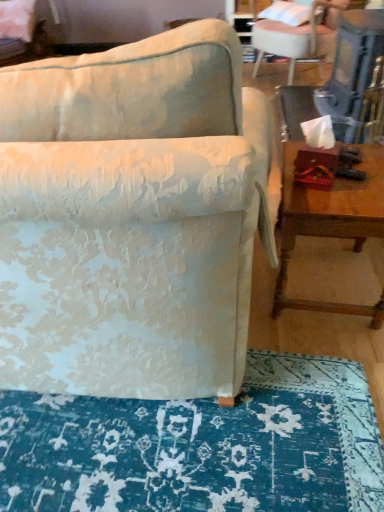
Question: Could you tell me if blue textured rug at lower center is facing white fabric chair at upper right, arranged as the second chair when viewed from the left?

Choices:
 (A) yes
 (B) no

Answer: (B)

Question: Are blue textured rug at lower center and white fabric chair at upper right, the 1th chair from the top, located far from each other?

Choices:
 (A) no
 (B) yes

Answer: (B)

Question: From a real-world perspective, is blue textured rug at lower center on top of white fabric chair at upper right, the second chair from the front?

Choices:
 (A) yes
 (B) no

Answer: (B)

Question: From the image's perspective, is blue textured rug at lower center below white fabric chair at upper right, the 1th chair from the top?

Choices:
 (A) no
 (B) yes

Answer: (B)

Question: Is blue textured rug at lower center facing away from white fabric chair at upper right, the 1th chair from the top?

Choices:
 (A) yes
 (B) no

Answer: (B)

Question: Does point click(x=331, y=396) appear closer or farther from the camera than point click(x=304, y=17)?

Choices:
 (A) farther
 (B) closer

Answer: (B)

Question: Considering the positions of blue textured rug at lower center and white fabric pillow at upper right in the image, is blue textured rug at lower center taller or shorter than white fabric pillow at upper right?

Choices:
 (A) short
 (B) tall

Answer: (A)

Question: In the image, is blue textured rug at lower center positioned in front of or behind white fabric pillow at upper right?

Choices:
 (A) behind
 (B) front

Answer: (B)

Question: Based on their sizes in the image, would you say blue textured rug at lower center is bigger or smaller than white fabric pillow at upper right?

Choices:
 (A) small
 (B) big

Answer: (B)

Question: From the image's perspective, is white fabric pillow at upper right above or below textured fabric chair at center, the 1th chair in the left-to-right sequence?

Choices:
 (A) below
 (B) above

Answer: (B)

Question: Is white fabric pillow at upper right wider or thinner than textured fabric chair at center, arranged as the first chair when viewed from the front?

Choices:
 (A) thin
 (B) wide

Answer: (A)

Question: Considering the relative positions of white fabric pillow at upper right and textured fabric chair at center, the 1th chair in the left-to-right sequence, in the image provided, is white fabric pillow at upper right to the left or to the right of textured fabric chair at center, the 1th chair in the left-to-right sequence,?

Choices:
 (A) right
 (B) left

Answer: (A)

Question: From a real-world perspective, is white fabric pillow at upper right positioned above or below textured fabric chair at center, the 2th chair in the top-to-bottom sequence?

Choices:
 (A) below
 (B) above

Answer: (B)

Question: From a real-world perspective, is white fabric chair at upper right, the 1th chair from the top, physically located above or below textured fabric chair at center, which is the second chair from back to front?

Choices:
 (A) above
 (B) below

Answer: (B)

Question: In terms of width, does white fabric chair at upper right, the first chair when ordered from right to left, look wider or thinner when compared to textured fabric chair at center, arranged as the 1th chair when ordered from the bottom?

Choices:
 (A) thin
 (B) wide

Answer: (A)